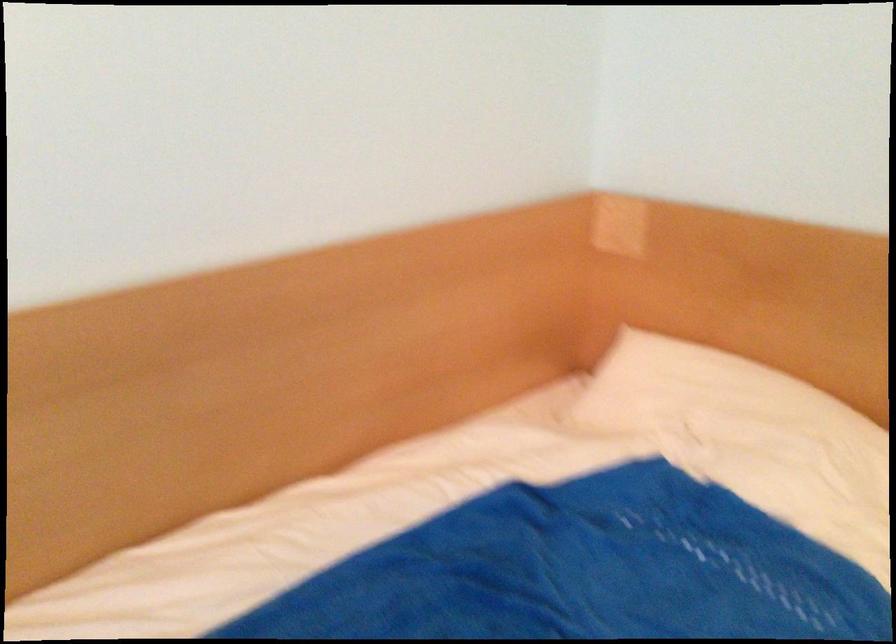
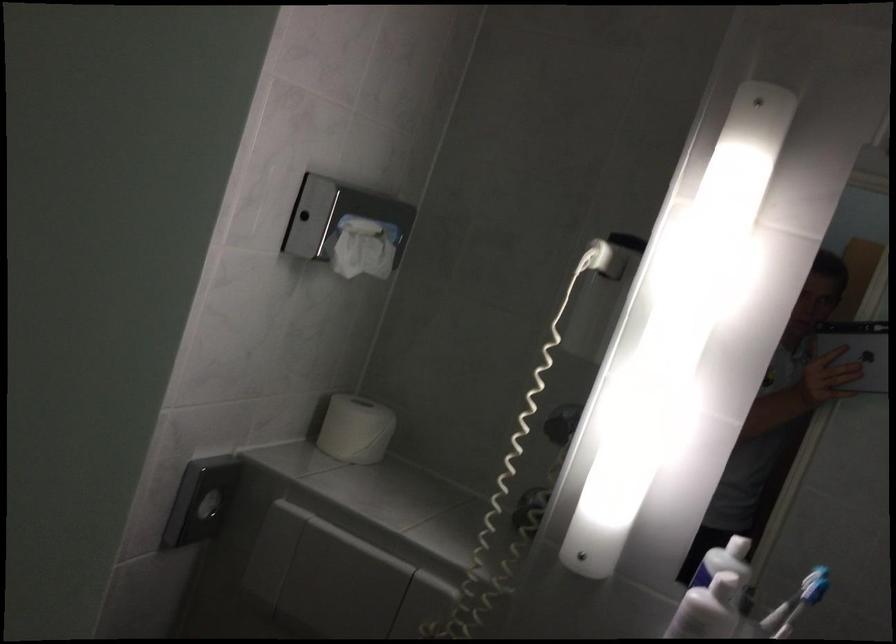
Locate, in the second image, the point that corresponds to pixel 781 156 in the first image.

(208, 506)